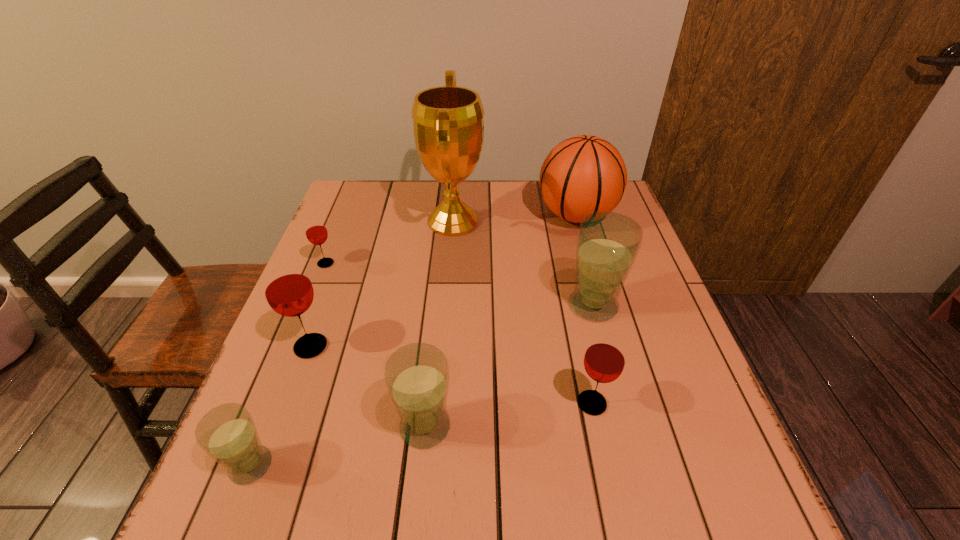
Where is `vacant region that satisfies the following two spatial constraints: 1. on the front-facing side of the award; 2. on the front side of the fourth nearest glass`? vacant region that satisfies the following two spatial constraints: 1. on the front-facing side of the award; 2. on the front side of the fourth nearest glass is located at coordinates (444, 347).

At what (x,y) coordinates should I click in order to perform the action: click on free space that satisfies the following two spatial constraints: 1. on the front-facing side of the gold award; 2. on the back side of the nearest red glass. Please return your answer as a coordinate pair (x, y). Looking at the image, I should click on (439, 403).

Image resolution: width=960 pixels, height=540 pixels. Find the location of `free spot that satisfies the following two spatial constraints: 1. on the front side of the farthest red glass; 2. on the left side of the fifth farthest object`. free spot that satisfies the following two spatial constraints: 1. on the front side of the farthest red glass; 2. on the left side of the fifth farthest object is located at coordinates (292, 347).

Find the location of a particular element. Image resolution: width=960 pixels, height=540 pixels. vacant area in the image that satisfies the following two spatial constraints: 1. on the front side of the nearest red glass; 2. on the right side of the biggest red glass is located at coordinates (290, 403).

This screenshot has width=960, height=540. Identify the location of free space that satisfies the following two spatial constraints: 1. on the front-facing side of the award; 2. on the front side of the fourth nearest object. (444, 347).

Locate an element on the screen. vacant space that satisfies the following two spatial constraints: 1. on the back side of the rightmost red glass; 2. on the right side of the leftmost blue glass is located at coordinates (276, 403).

Identify the location of free region that satisfies the following two spatial constraints: 1. on the front-facing side of the farthest blue glass; 2. on the right side of the gold award. (446, 306).